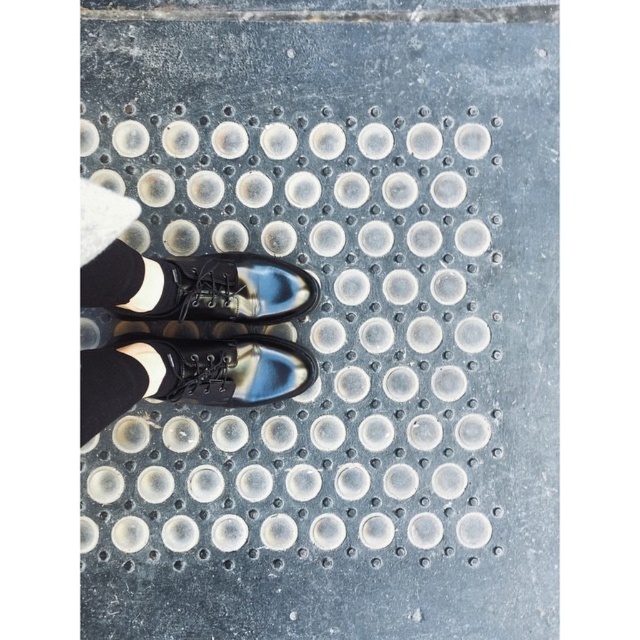
You are a visually impaired individual using a cane to navigate the textured surface. You feel the black leather shoes at center and the black wool sock at lower left. Which object is closer to your cane tip?

The black leather shoes at center is in front of the black wool sock at lower left, so the black leather shoes at center is closer to your cane tip.

You are a person with visual impairment navigating using a cane. You feel two objects under your feet while walking on the tactile paving block. Which object is wider between the black leather shoes at center and the black wool sock at lower left?

The black leather shoes at center are wider than the black wool sock at lower left.